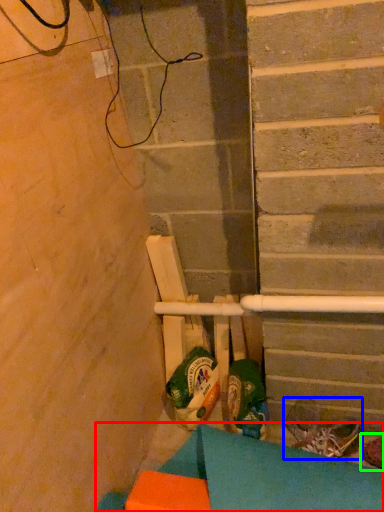
Question: Considering the real-world distances, which object is closest to furniture (highlighted by a red box)? footwear (highlighted by a blue box) or footwear (highlighted by a green box).

Choices:
 (A) footwear
 (B) footwear

Answer: (A)